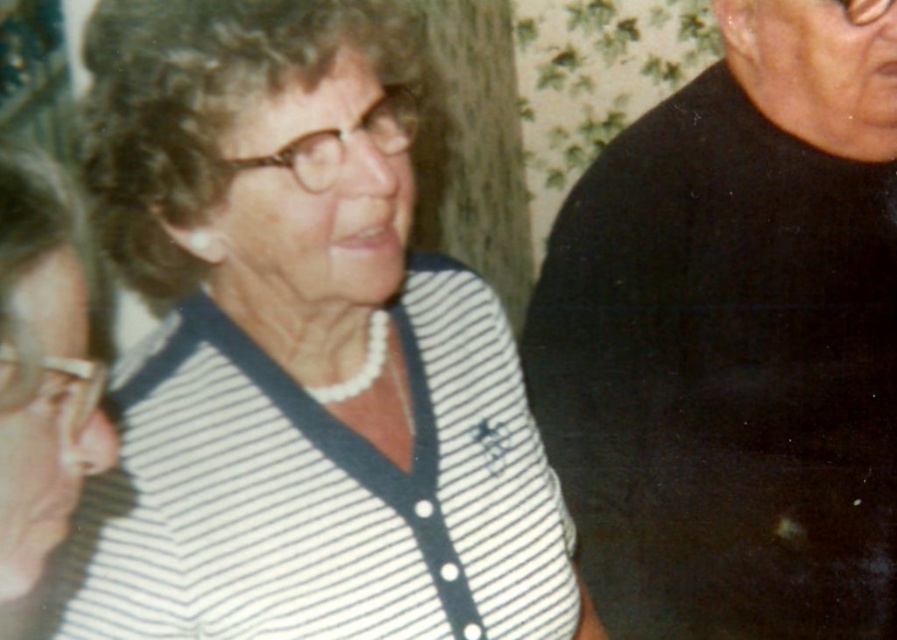
Looking at this image, you are an interior designer assessing the spatial arrangement of the clothing items in the image. Given that the black matte shirt at right and the white striped sweater at center are displayed on hangers in the closet, which clothing item requires a taller hanger?

The black matte shirt at right requires a taller hanger because it has a greater height compared to the white striped sweater at center.

Where is the black matte shirt at right located in the image?

The black matte shirt at right is located at point coordinates of (736, 340).